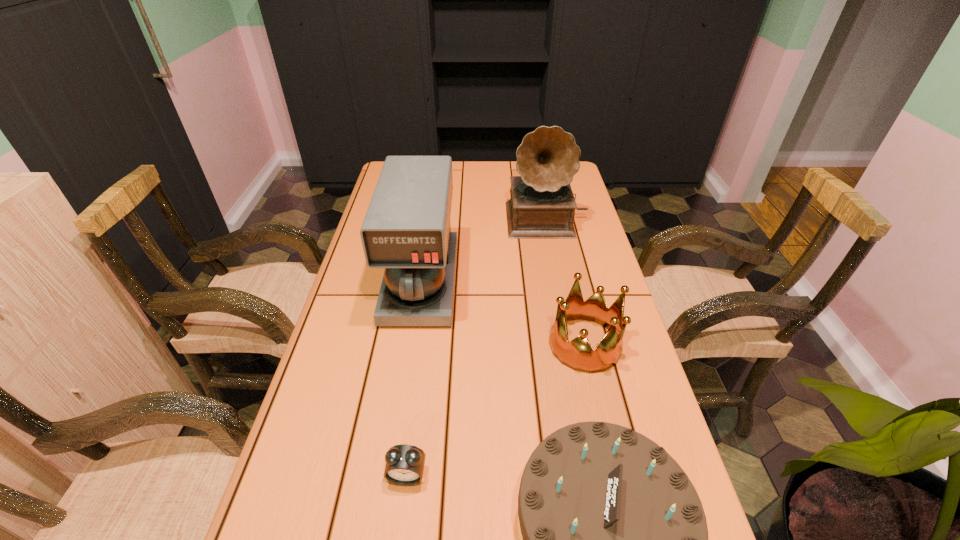
Locate an element on the screen. Image resolution: width=960 pixels, height=540 pixels. object that is the closest to the crown is located at coordinates [613, 539].